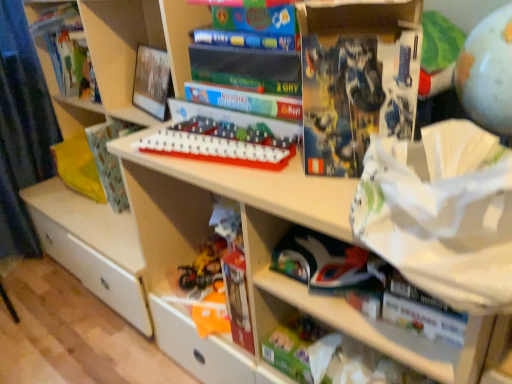
Question: Considering the relative sizes of white plastic game board at center, the third toy when ordered from bottom to top, and matte gray globe at upper right, acting as the first toy starting from the front, in the image provided, is white plastic game board at center, the third toy when ordered from bottom to top, smaller than matte gray globe at upper right, acting as the first toy starting from the front,?

Choices:
 (A) no
 (B) yes

Answer: (B)

Question: Does white plastic game board at center, the 3th toy positioned from the back, appear on the left side of matte gray globe at upper right, positioned as the 1th toy in top-to-bottom order?

Choices:
 (A) no
 (B) yes

Answer: (B)

Question: Does white plastic game board at center, the 3th toy positioned from the back, have a lesser width compared to matte gray globe at upper right, marked as the fourth toy in a left-to-right arrangement?

Choices:
 (A) yes
 (B) no

Answer: (B)

Question: From the image's perspective, is white plastic game board at center, the 3th toy positioned from the back, below matte gray globe at upper right, marked as the fourth toy in a left-to-right arrangement?

Choices:
 (A) yes
 (B) no

Answer: (A)

Question: Can you confirm if white plastic game board at center, the third toy when ordered from bottom to top, is positioned to the right of matte gray globe at upper right, the first toy in the right-to-left sequence?

Choices:
 (A) no
 (B) yes

Answer: (A)

Question: Does white plastic game board at center, the second toy in the front-to-back sequence, have a greater width compared to matte gray globe at upper right, positioned as the 1th toy in top-to-bottom order?

Choices:
 (A) no
 (B) yes

Answer: (B)

Question: From a real-world perspective, is patterned paper at left, which is the 2th paperback book from front to back, under white plastic game board at center, the third toy when ordered from bottom to top?

Choices:
 (A) yes
 (B) no

Answer: (A)

Question: Is patterned paper at left, the 1th paperback book positioned from the left, placed right next to white plastic game board at center, the 3th toy positioned from the back?

Choices:
 (A) no
 (B) yes

Answer: (A)

Question: From the image's perspective, is patterned paper at left, which is the 2th paperback book from front to back, located beneath white plastic game board at center, the 3th toy positioned from the back?

Choices:
 (A) yes
 (B) no

Answer: (A)

Question: Is patterned paper at left, the 1th paperback book positioned from the back, looking in the opposite direction of white plastic game board at center, the 3th toy positioned from the back?

Choices:
 (A) no
 (B) yes

Answer: (A)

Question: Could you tell me if patterned paper at left, the 1th paperback book positioned from the back, is turned towards white plastic game board at center, marked as the 3th toy in a right-to-left arrangement?

Choices:
 (A) yes
 (B) no

Answer: (B)

Question: Can you confirm if patterned paper at left, the 1th paperback book positioned from the back, is positioned to the left of white plastic game board at center, the third toy when ordered from bottom to top?

Choices:
 (A) yes
 (B) no

Answer: (A)

Question: Is the surface of green matte toy at lower center, placed as the 3th toy when sorted from front to back, in direct contact with shiny plastic toys at lower center, placed as the 2th toy when sorted from bottom to top?

Choices:
 (A) yes
 (B) no

Answer: (B)